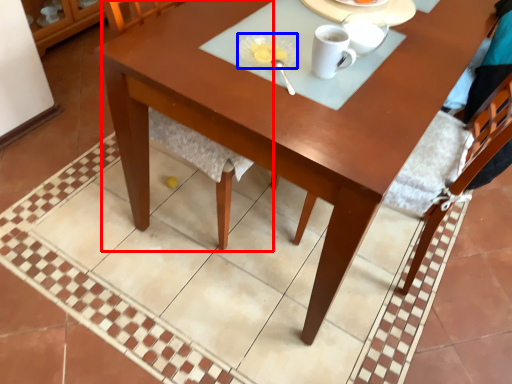
Question: Which object is further to the camera taking this photo, chair (highlighted by a red box) or tableware (highlighted by a blue box)?

Choices:
 (A) chair
 (B) tableware

Answer: (B)